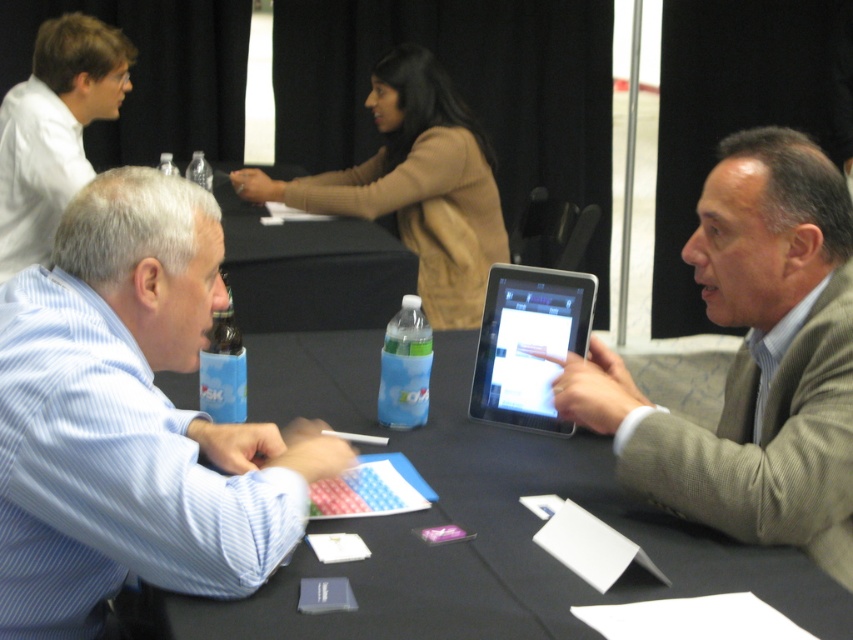
Question: Which object appears closest to the camera in this image?

Choices:
 (A) tan sweater at upper center
 (B) light brown textured blazer at right

Answer: (B)

Question: Where is light brown textured blazer at right located in relation to black glossy tablet at center in the image?

Choices:
 (A) below
 (B) above

Answer: (A)

Question: Which point is farther to the camera?

Choices:
 (A) (90, 64)
 (B) (724, 198)
 (C) (412, 172)
 (D) (532, 404)

Answer: (C)

Question: Is blue striped shirt at left in front of white shirt at upper left?

Choices:
 (A) yes
 (B) no

Answer: (A)

Question: Can you confirm if black fabric table at center is positioned to the right of light brown textured blazer at right?

Choices:
 (A) no
 (B) yes

Answer: (A)

Question: Which of these objects is positioned farthest from the light brown textured blazer at right?

Choices:
 (A) tan sweater at upper center
 (B) blue striped shirt at left

Answer: (A)